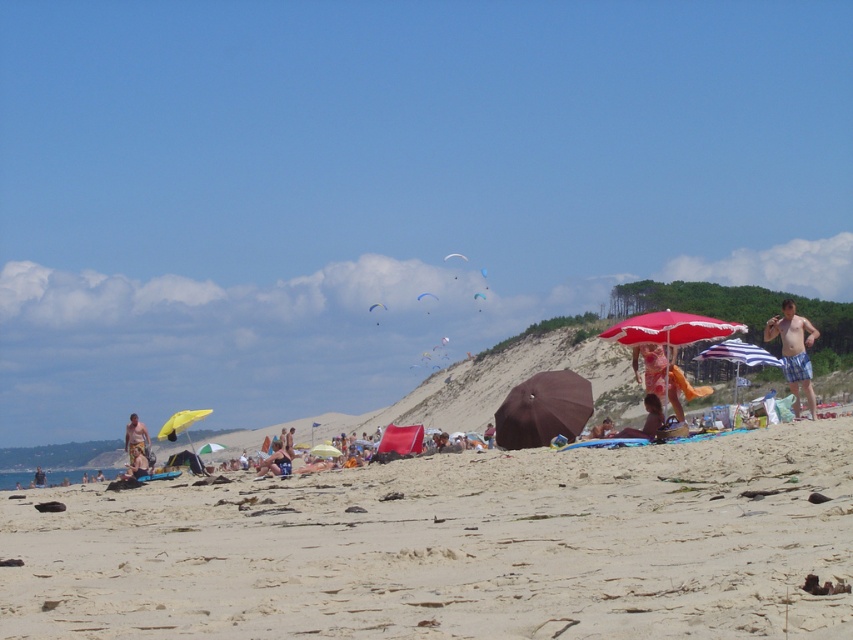
Looking at this image, can you confirm if yellow striped shorts at lower left is bigger than blue denim shorts at center?

Correct, yellow striped shorts at lower left is larger in size than blue denim shorts at center.

Which is more to the left, yellow striped shorts at lower left or blue denim shorts at center?

yellow striped shorts at lower left

Which is in front, point (137, 445) or point (286, 470)?

Point (286, 470) is in front.

The image size is (853, 640). I want to click on yellow striped shorts at lower left, so click(x=135, y=436).

Who is more forward, (496, 536) or (283, 454)?

Point (496, 536) is in front.

Who is lower down, beige sandy beach at center or blue denim shorts at center?

blue denim shorts at center is lower down.

Which is in front, point (627, 477) or point (265, 464)?

Point (627, 477) is in front.

Where is `beige sandy beach at center`? The image size is (853, 640). beige sandy beach at center is located at coordinates (454, 547).

Looking at this image, which is below, beige sandy beach at center or printed cotton dress at center?

Positioned lower is beige sandy beach at center.

In the scene shown: Measure the distance from beige sandy beach at center to printed cotton dress at center.

beige sandy beach at center and printed cotton dress at center are 66.14 feet apart from each other.

The width and height of the screenshot is (853, 640). I want to click on beige sandy beach at center, so click(454, 547).